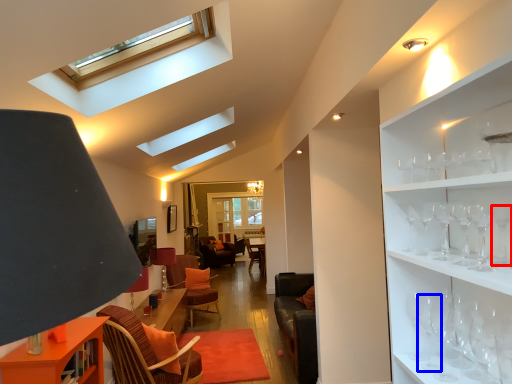
Question: Which point is further to the camera, wine glass (highlighted by a red box) or wine glass (highlighted by a blue box)?

Choices:
 (A) wine glass
 (B) wine glass

Answer: (B)